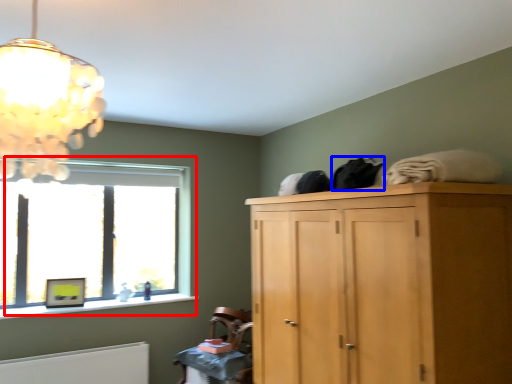
Question: Which object is further to the camera taking this photo, window (highlighted by a red box) or clothing (highlighted by a blue box)?

Choices:
 (A) window
 (B) clothing

Answer: (A)